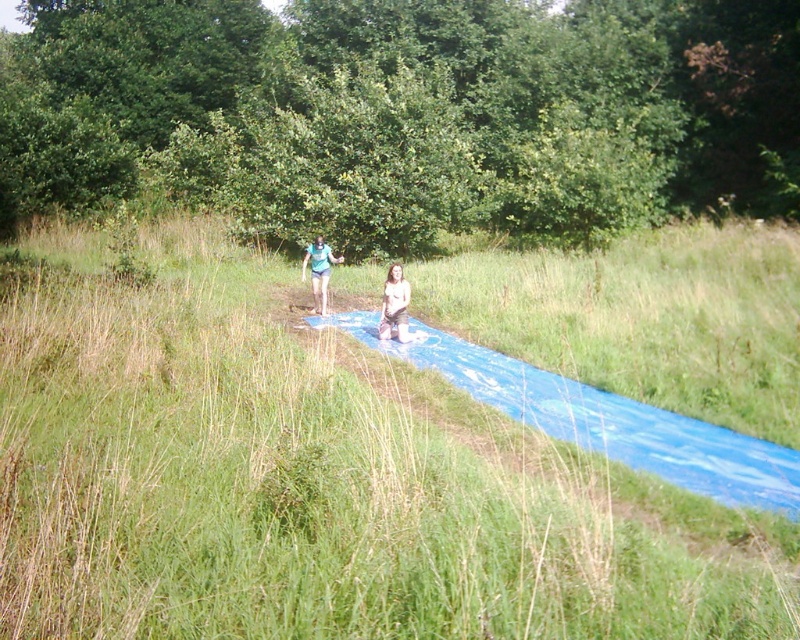
Does tan skin person at center have a larger size compared to matte blue shorts at center?

No, tan skin person at center is not bigger than matte blue shorts at center.

Does tan skin person at center lie in front of matte blue shorts at center?

Yes.

Does point (405, 337) lie in front of point (316, 256)?

Yes, point (405, 337) is closer to viewer.

Identify the location of tan skin person at center. This screenshot has height=640, width=800. (396, 307).

Between blue rubber mat at center and tan skin person at center, which one is positioned lower?

tan skin person at center is lower down.

Can you confirm if blue rubber mat at center is positioned to the left of tan skin person at center?

No, blue rubber mat at center is not to the left of tan skin person at center.

The width and height of the screenshot is (800, 640). Identify the location of blue rubber mat at center. (316, 477).

Is blue rubber mat at center wider than matte blue shorts at center?

Yes.

This screenshot has height=640, width=800. Describe the element at coordinates (316, 477) in the screenshot. I see `blue rubber mat at center` at that location.

Identify the location of blue rubber mat at center. (316, 477).

Image resolution: width=800 pixels, height=640 pixels. In order to click on blue rubber mat at center in this screenshot , I will do `click(316, 477)`.